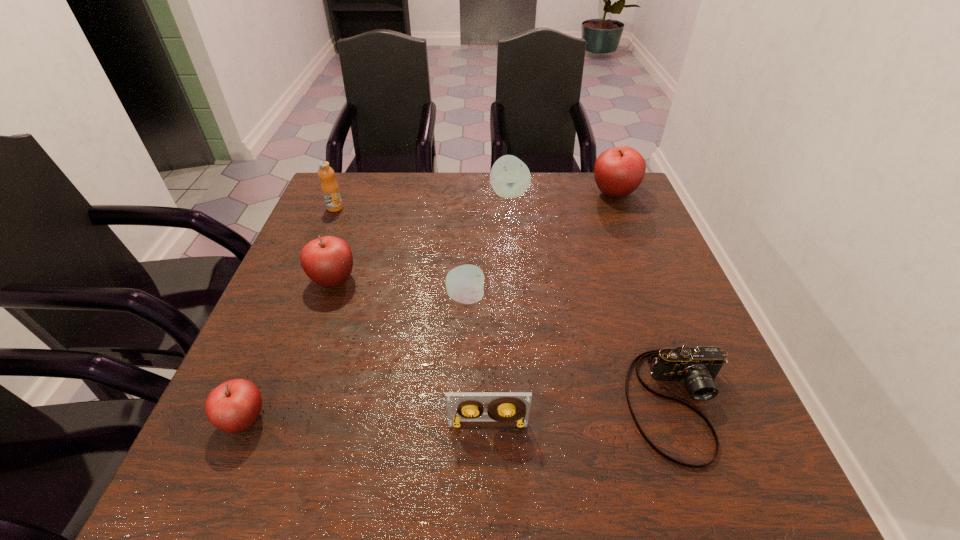
The height and width of the screenshot is (540, 960). I want to click on free area in between the orange juice and the brown camera, so click(508, 306).

Find the location of a particular element. This screenshot has width=960, height=540. blank region between the rightmost red apple and the nearer white apple is located at coordinates (540, 245).

Locate an element on the screen. The height and width of the screenshot is (540, 960). object that ranks as the third closest to the videotape is located at coordinates (234, 406).

Choose which object is the third nearest neighbor to the smaller white apple. Please provide its 2D coordinates. Your answer should be formatted as a tuple, i.e. [(x, y)], where the tuple contains the x and y coordinates of a point satisfying the conditions above.

[(697, 367)]

Point out which apple is positioned as the fourth nearest to the farther white apple. Please provide its 2D coordinates. Your answer should be formatted as a tuple, i.e. [(x, y)], where the tuple contains the x and y coordinates of a point satisfying the conditions above.

[(234, 406)]

Select which apple is the fourth closest to the tallest apple. Please provide its 2D coordinates. Your answer should be formatted as a tuple, i.e. [(x, y)], where the tuple contains the x and y coordinates of a point satisfying the conditions above.

[(234, 406)]

Identify which red apple is the closest to the nearest red apple. Please provide its 2D coordinates. Your answer should be formatted as a tuple, i.e. [(x, y)], where the tuple contains the x and y coordinates of a point satisfying the conditions above.

[(328, 261)]

Where is `red apple that is the second closest to the second farthest red apple`? red apple that is the second closest to the second farthest red apple is located at coordinates (618, 171).

I want to click on free point that satisfies the following two spatial constraints: 1. on the back side of the smallest red apple; 2. on the right side of the rightmost apple, so click(x=340, y=193).